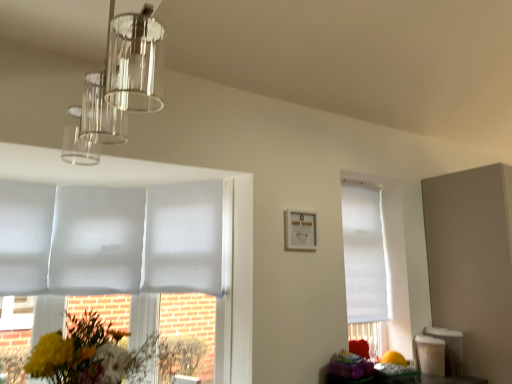
Question: Could you tell me if fluffy bouquet at lower left is turned towards white matte blind at left, which appears as the first blind when viewed from the left?

Choices:
 (A) no
 (B) yes

Answer: (A)

Question: Can you confirm if fluffy bouquet at lower left is thinner than white matte blind at left, positioned as the 4th blind in right-to-left order?

Choices:
 (A) yes
 (B) no

Answer: (B)

Question: From a real-world perspective, is fluffy bouquet at lower left positioned under white matte blind at left, positioned as the 4th blind in right-to-left order, based on gravity?

Choices:
 (A) yes
 (B) no

Answer: (A)

Question: Is fluffy bouquet at lower left positioned beyond the bounds of white matte blind at left, which appears as the first blind when viewed from the left?

Choices:
 (A) no
 (B) yes

Answer: (B)

Question: Is fluffy bouquet at lower left positioned behind white matte blind at left, positioned as the 4th blind in right-to-left order?

Choices:
 (A) no
 (B) yes

Answer: (A)

Question: Is fluffy bouquet at lower left positioned before white matte blind at left, which appears as the first blind when viewed from the left?

Choices:
 (A) no
 (B) yes

Answer: (B)

Question: Is clear glass pendant light at upper left bigger than matte white picture frame at center?

Choices:
 (A) no
 (B) yes

Answer: (B)

Question: From a real-world perspective, is clear glass pendant light at upper left below matte white picture frame at center?

Choices:
 (A) yes
 (B) no

Answer: (B)

Question: Does clear glass pendant light at upper left have a lesser height compared to matte white picture frame at center?

Choices:
 (A) no
 (B) yes

Answer: (A)

Question: Is clear glass pendant light at upper left positioned before matte white picture frame at center?

Choices:
 (A) no
 (B) yes

Answer: (B)

Question: From the image's perspective, is clear glass pendant light at upper left above matte white picture frame at center?

Choices:
 (A) yes
 (B) no

Answer: (A)

Question: Considering the relative sizes of clear glass pendant light at upper left and matte white picture frame at center in the image provided, is clear glass pendant light at upper left taller than matte white picture frame at center?

Choices:
 (A) yes
 (B) no

Answer: (A)

Question: Can you confirm if white matte blind at right, placed as the fourth blind when sorted from left to right, is taller than clear glass pendant light at upper left?

Choices:
 (A) no
 (B) yes

Answer: (B)